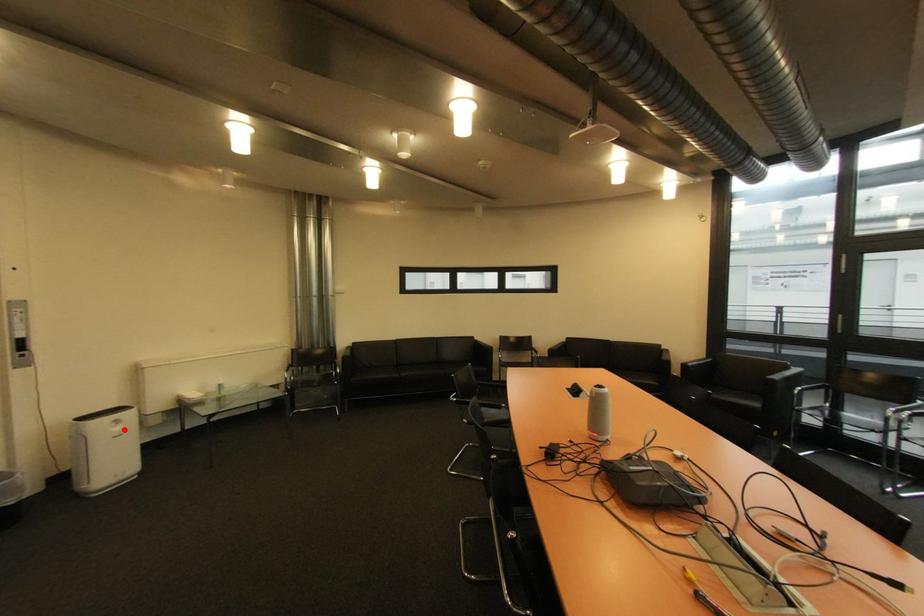
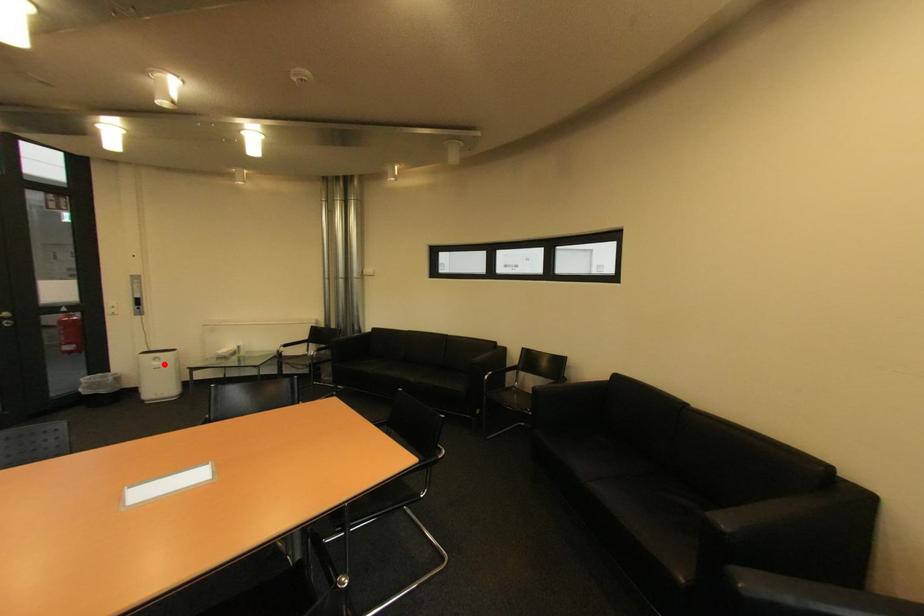
I am providing you with two images of the same scene from different viewpoints. A red point is marked on the first image and another point is marked on the second image. Is the red point in image1 aligned with the point shown in image2?

Yes